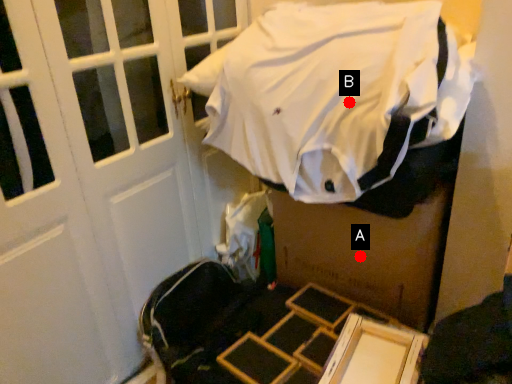
Question: Two points are circled on the image, labeled by A and B beside each circle. Which point is farther to the camera?

Choices:
 (A) A is further
 (B) B is further

Answer: (A)